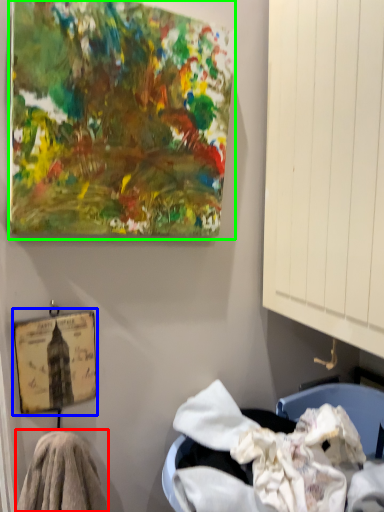
Question: Which object is positioned farthest from material (highlighted by a red box)? Select from picture frame (highlighted by a blue box) and oil painting (highlighted by a green box).

Choices:
 (A) picture frame
 (B) oil painting

Answer: (B)